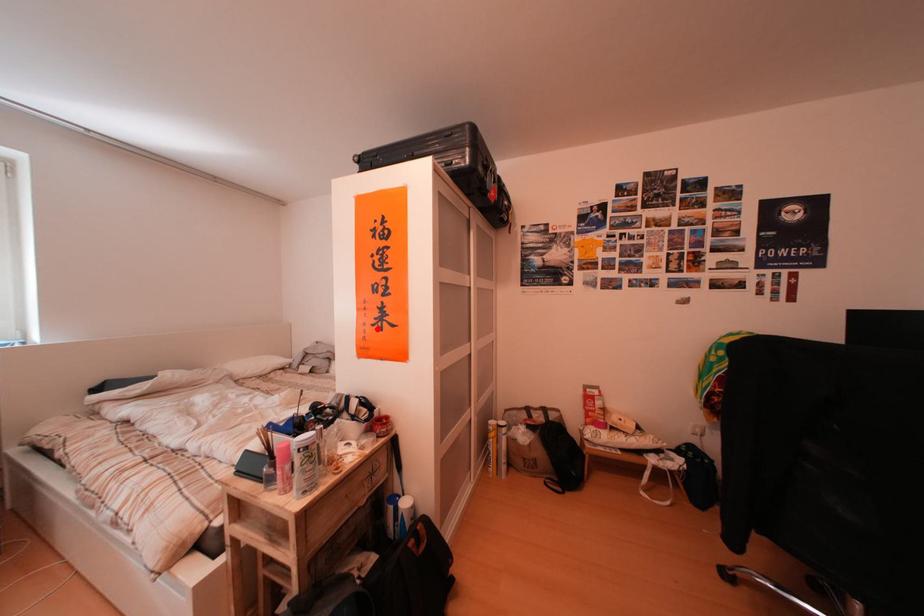
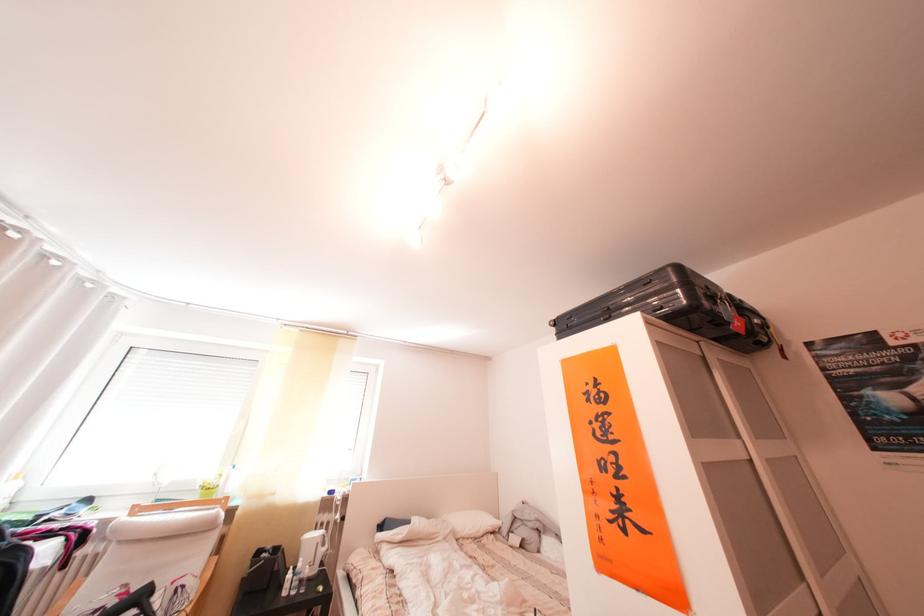
Where in the second image is the point corresponding to the highlighted location from the first image?

(610, 522)